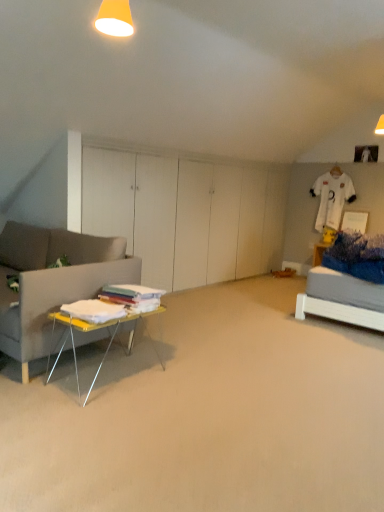
Question: Should I look upward or downward to see yellow matte lampshade at upper center?

Choices:
 (A) down
 (B) up

Answer: (B)

Question: Does white fabric at left have a lesser height compared to yellow matte lampshade at upper center?

Choices:
 (A) no
 (B) yes

Answer: (B)

Question: Considering the relative sizes of white fabric at left and yellow matte lampshade at upper center in the image provided, is white fabric at left smaller than yellow matte lampshade at upper center?

Choices:
 (A) no
 (B) yes

Answer: (A)

Question: From the image's perspective, is white fabric at left beneath yellow matte lampshade at upper center?

Choices:
 (A) yes
 (B) no

Answer: (A)

Question: From the image's perspective, is white fabric at left above yellow matte lampshade at upper center?

Choices:
 (A) no
 (B) yes

Answer: (A)

Question: Is there a large distance between white fabric at left and yellow matte lampshade at upper center?

Choices:
 (A) yes
 (B) no

Answer: (A)

Question: Is the position of white fabric at left more distant than that of yellow matte lampshade at upper center?

Choices:
 (A) no
 (B) yes

Answer: (A)

Question: From a real-world perspective, is yellow metallic table at lower left over white fabric at left?

Choices:
 (A) yes
 (B) no

Answer: (A)

Question: Is yellow metallic table at lower left oriented towards white fabric at left?

Choices:
 (A) no
 (B) yes

Answer: (A)

Question: Considering the relative sizes of yellow metallic table at lower left and white fabric at left in the image provided, is yellow metallic table at lower left thinner than white fabric at left?

Choices:
 (A) yes
 (B) no

Answer: (A)

Question: Is white fabric at left completely or partially inside yellow metallic table at lower left?

Choices:
 (A) yes
 (B) no

Answer: (B)

Question: Does yellow metallic table at lower left have a greater width compared to white fabric at left?

Choices:
 (A) no
 (B) yes

Answer: (A)

Question: Is yellow metallic table at lower left to the right of white fabric at left from the viewer's perspective?

Choices:
 (A) yes
 (B) no

Answer: (B)

Question: Considering the relative sizes of yellow matte lampshade at upper center and yellow metallic table at lower left in the image provided, is yellow matte lampshade at upper center thinner than yellow metallic table at lower left?

Choices:
 (A) no
 (B) yes

Answer: (B)